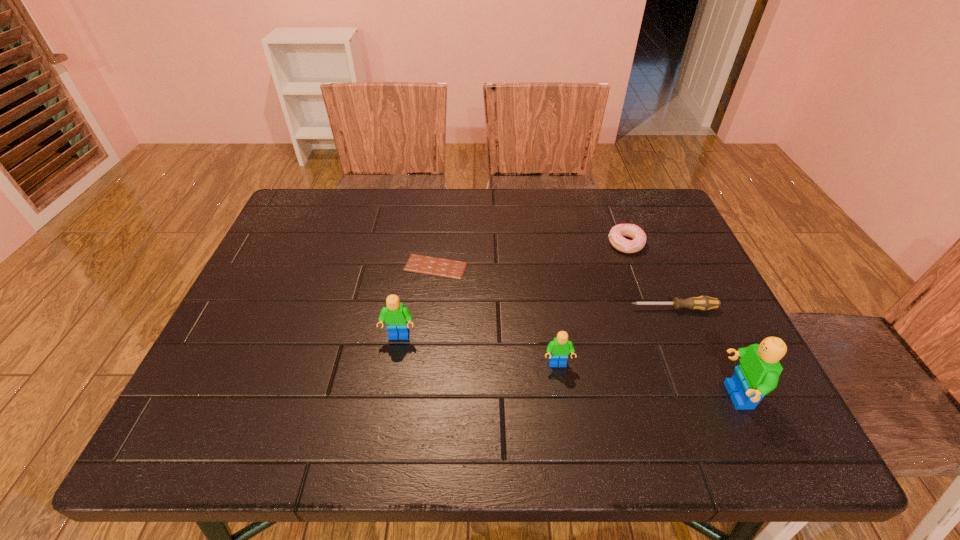
The image size is (960, 540). Identify the location of the second tallest Lego. pyautogui.click(x=397, y=317).

Locate an element on the screen. This screenshot has height=540, width=960. the fifth shortest object is located at coordinates (397, 317).

Locate an element on the screen. the fifth farthest object is located at coordinates (558, 349).

Where is `the fourth shortest object`? the fourth shortest object is located at coordinates (558, 349).

Where is `the rightmost Lego`? The width and height of the screenshot is (960, 540). the rightmost Lego is located at coordinates (757, 375).

This screenshot has height=540, width=960. In order to click on the tallest Lego in this screenshot , I will do `click(757, 375)`.

Where is `doughnut`? The image size is (960, 540). doughnut is located at coordinates (616, 234).

Locate an element on the screen. This screenshot has width=960, height=540. chocolate bar is located at coordinates (434, 266).

Locate an element on the screen. screwdriver is located at coordinates (704, 303).

In order to click on the fourth nearest object in this screenshot , I will do `click(704, 303)`.